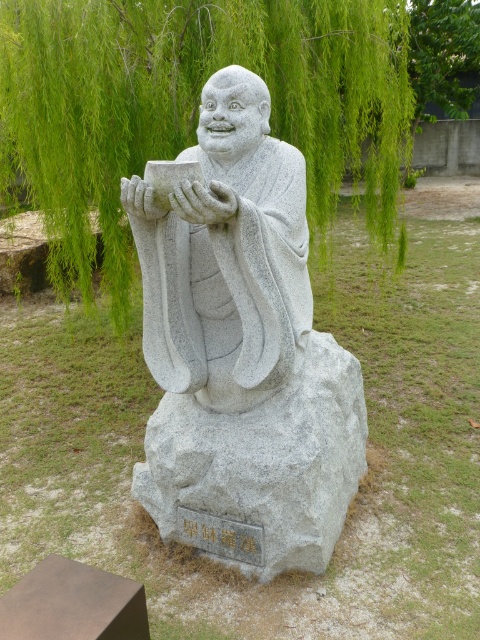
Locate an element on the screen. This screenshot has width=480, height=640. gray stone statue at center is located at coordinates pos(241,353).

Who is more forward, (222,392) or (96,106)?

Positioned in front is point (222,392).

Who is more forward, (247, 467) or (330, 116)?

Point (247, 467) is in front.

You are a GUI agent. You are given a task and a screenshot of the screen. Output one action in this format:
    pyautogui.click(x=<x>, y=<y>)
    Task: Click on the gray stone statue at center
    
    Given the screenshot: What is the action you would take?
    pyautogui.click(x=241, y=353)

Is green leafy willow at upper center positioned in front of green leafy tree at upper center?

That is True.

Between point (274, 0) and point (468, 26), which one is positioned behind?

Positioned behind is point (468, 26).

Locate an element on the screen. green leafy willow at upper center is located at coordinates (191, 106).

In the scene shown: Can you confirm if gray stone statue at center is wider than green leafy tree at upper center?

Incorrect, gray stone statue at center's width does not surpass green leafy tree at upper center's.

Between point (241, 460) and point (423, 67), which one is positioned in front?

Point (241, 460)

Where is `gray stone statue at center`? The height and width of the screenshot is (640, 480). gray stone statue at center is located at coordinates (241, 353).